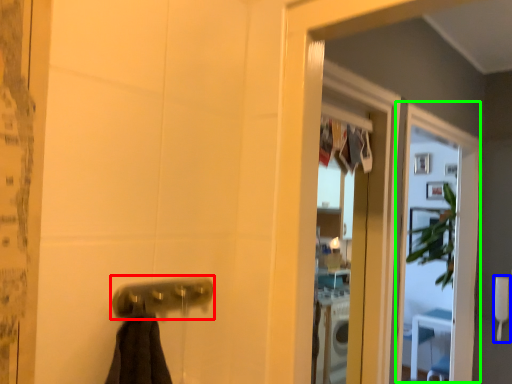
Question: Based on their relative distances, which object is nearer to door handle (highlighted by a red box)? Choose from towel bar (highlighted by a blue box) and screen door (highlighted by a green box).

Choices:
 (A) towel bar
 (B) screen door

Answer: (B)